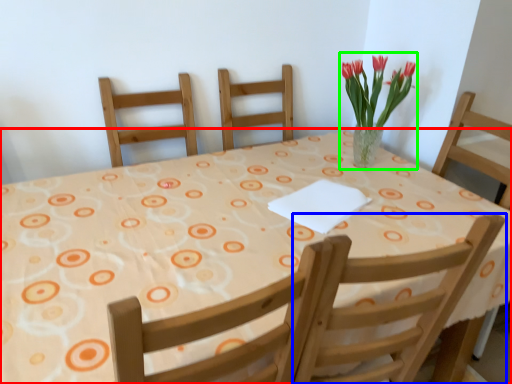
Question: Which object is positioned farthest from table (highlighted by a red box)? Select from chair (highlighted by a blue box) and floral arrangement (highlighted by a green box).

Choices:
 (A) chair
 (B) floral arrangement

Answer: (B)